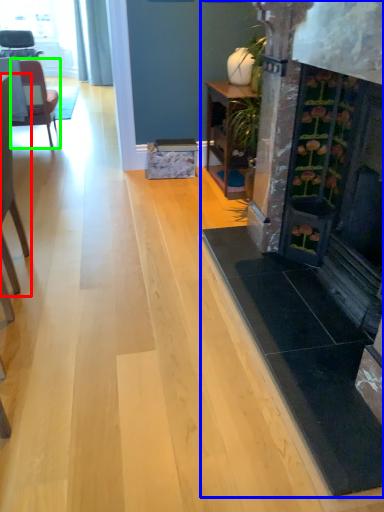
Question: Considering the real-world distances, which object is farthest from chair (highlighted by a red box)? fireplace (highlighted by a blue box) or chair (highlighted by a green box)?

Choices:
 (A) fireplace
 (B) chair

Answer: (B)